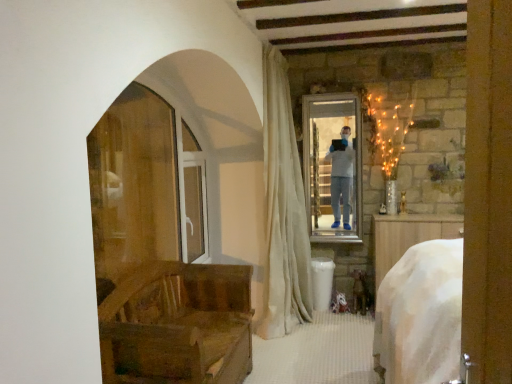
Question: Could you tell me if clear glass screen door at center is facing wooden chair at left?

Choices:
 (A) no
 (B) yes

Answer: (A)

Question: Can we say clear glass screen door at center lies outside wooden chair at left?

Choices:
 (A) yes
 (B) no

Answer: (A)

Question: Is clear glass screen door at center shorter than wooden chair at left?

Choices:
 (A) yes
 (B) no

Answer: (B)

Question: Is clear glass screen door at center taller than wooden chair at left?

Choices:
 (A) no
 (B) yes

Answer: (B)

Question: From the image's perspective, is clear glass screen door at center below wooden chair at left?

Choices:
 (A) no
 (B) yes

Answer: (A)

Question: From a real-world perspective, is clear glass screen door at center positioned over wooden chair at left based on gravity?

Choices:
 (A) no
 (B) yes

Answer: (B)

Question: Can you confirm if wooden chair at left is positioned to the left of clear glass screen door at center?

Choices:
 (A) yes
 (B) no

Answer: (B)

Question: Is wooden chair at left positioned with its back to clear glass screen door at center?

Choices:
 (A) no
 (B) yes

Answer: (A)

Question: Does wooden chair at left appear on the right side of clear glass screen door at center?

Choices:
 (A) yes
 (B) no

Answer: (A)

Question: Does wooden chair at left have a smaller size compared to clear glass screen door at center?

Choices:
 (A) yes
 (B) no

Answer: (B)

Question: Does wooden chair at left have a larger size compared to clear glass screen door at center?

Choices:
 (A) yes
 (B) no

Answer: (A)

Question: Could you tell me if wooden chair at left is turned towards clear glass screen door at center?

Choices:
 (A) no
 (B) yes

Answer: (A)

Question: Does white velvet curtain at center have a greater width compared to wooden chair at left?

Choices:
 (A) no
 (B) yes

Answer: (A)